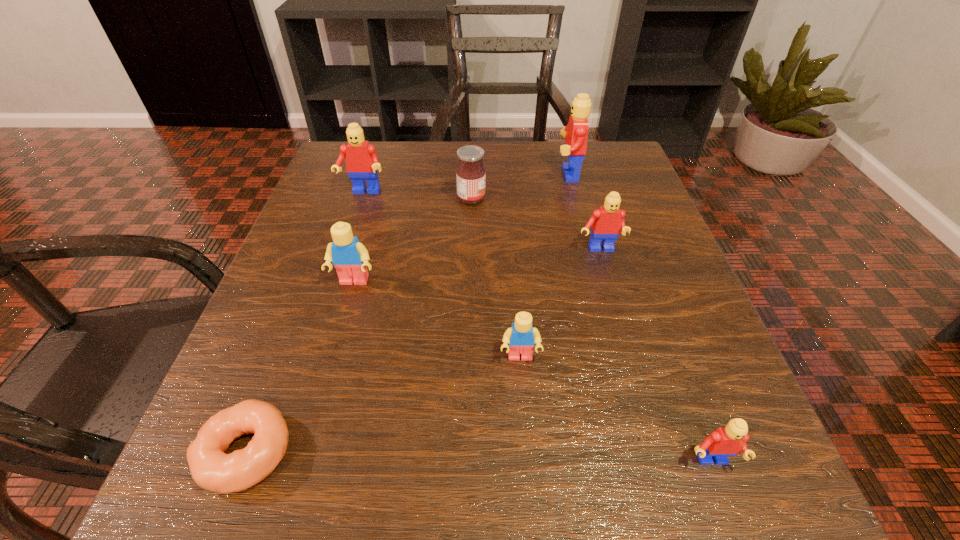
I want to click on the biggest red Lego, so click(x=575, y=133).

The image size is (960, 540). In order to click on the tallest Lego in this screenshot , I will do `click(575, 133)`.

This screenshot has width=960, height=540. What are the coordinates of `the second tallest object` in the screenshot? It's located at (362, 163).

I want to click on the third smallest red Lego, so click(362, 163).

Locate an element on the screen. Image resolution: width=960 pixels, height=540 pixels. the fourth farthest Lego is located at coordinates (350, 257).

I want to click on the farther yellow Lego, so click(x=350, y=257).

The image size is (960, 540). Find the location of `the fifth nearest object`. the fifth nearest object is located at coordinates (607, 222).

Locate an element on the screen. This screenshot has height=540, width=960. the third farthest red Lego is located at coordinates (607, 222).

The height and width of the screenshot is (540, 960). Find the location of `jam`. jam is located at coordinates (470, 173).

The image size is (960, 540). I want to click on the fifth object from left to right, so click(521, 336).